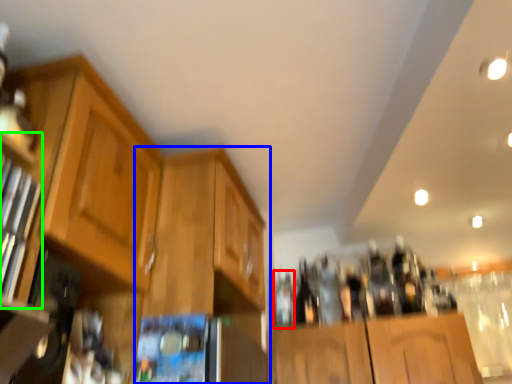
Question: Which is nearer to the bottle (highlighted by a red box)? cabinetry (highlighted by a blue box) or shelf (highlighted by a green box).

Choices:
 (A) cabinetry
 (B) shelf

Answer: (A)